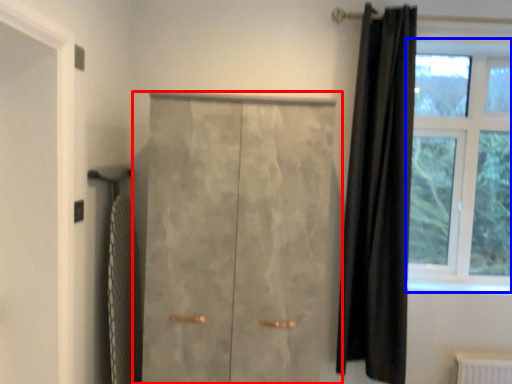
Question: Which point is closer to the camera, door (highlighted by a red box) or window (highlighted by a blue box)?

Choices:
 (A) door
 (B) window

Answer: (A)